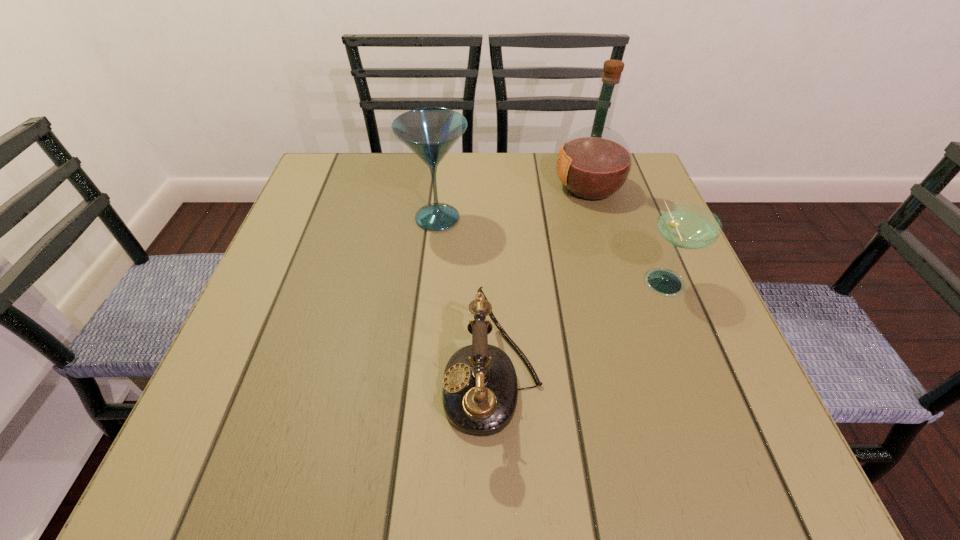
Identify the location of liquor. The width and height of the screenshot is (960, 540). (594, 163).

Image resolution: width=960 pixels, height=540 pixels. Find the location of `the left martini`. the left martini is located at coordinates (430, 132).

Identify the location of the third shortest object. 430,132.

Locate an element on the screen. The height and width of the screenshot is (540, 960). the nearer martini is located at coordinates (687, 226).

Where is `the second nearest object`? The width and height of the screenshot is (960, 540). the second nearest object is located at coordinates (687, 226).

Where is `telephone`? telephone is located at coordinates (480, 391).

Find the location of a particular element. This screenshot has width=960, height=540. vacant region located on the front label of the liquor is located at coordinates (468, 187).

At what (x,y) coordinates should I click in order to perform the action: click on blank space located 0.060m on the front label of the liquor. Please return your answer as a coordinate pair (x, y). The height and width of the screenshot is (540, 960). Looking at the image, I should click on (529, 187).

Image resolution: width=960 pixels, height=540 pixels. Find the location of `vacant position located 0.180m on the front label of the liquor`. vacant position located 0.180m on the front label of the liquor is located at coordinates (480, 187).

Find the location of `vacant space located 0.150m on the right of the third shortest object`. vacant space located 0.150m on the right of the third shortest object is located at coordinates (536, 218).